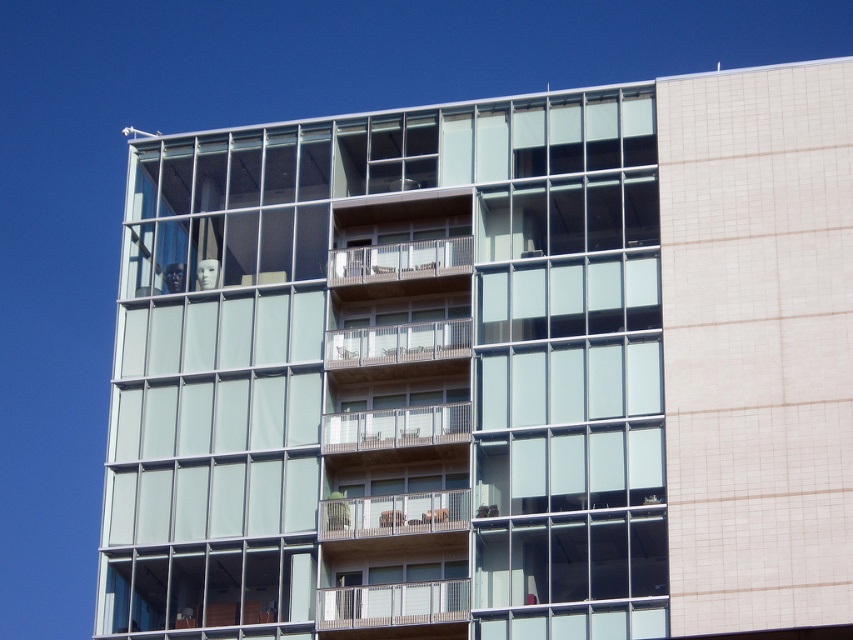
You are an architect evaluating the building facade. You need to install a new security camera. The camera requires a mounting point that can accommodate its size. Given the clear glass windows at center and the wooden railing at lower center, which object would be more suitable for mounting the camera based on their sizes?

The clear glass windows at center has a larger size compared to wooden railing at lower center, so the clear glass windows at center would be more suitable for mounting the security camera as it provides a larger surface area to accommodate the camera.

Based on the photo, you are a delivery person trying to place a package on the wooden brown balcony at center. However, there is already a wooden balcony at center. Which one is smaller and can accommodate the package?

The wooden brown balcony at center is smaller compared to the wooden balcony at center, so it can accommodate the package.

You are standing at the base of the modern multi story building with glass panels and balconies. You want to take a photo of the mannequin head located at point (339, 593). Your camera has a maximum zoom range of 50 meters. Can you capture the mannequin head clearly without moving closer?

The distance between point (339, 593) and the camera is 55.77 meters, which exceeds the camera maximum zoom range of 50 meters. Therefore, you cannot capture the mannequin head clearly without moving closer.